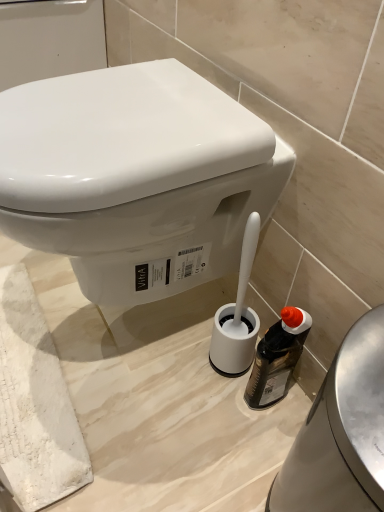
Question: Is white plastic toilet brush holder at lower center with translucent plastic bottle at lower right?

Choices:
 (A) no
 (B) yes

Answer: (A)

Question: Is white plastic toilet brush holder at lower center behind translucent plastic bottle at lower right?

Choices:
 (A) yes
 (B) no

Answer: (B)

Question: Does white plastic toilet brush holder at lower center appear on the right side of translucent plastic bottle at lower right?

Choices:
 (A) no
 (B) yes

Answer: (B)

Question: Does white plastic toilet brush holder at lower center appear on the left side of translucent plastic bottle at lower right?

Choices:
 (A) no
 (B) yes

Answer: (A)

Question: Considering the relative sizes of white plastic toilet brush holder at lower center and translucent plastic bottle at lower right in the image provided, is white plastic toilet brush holder at lower center shorter than translucent plastic bottle at lower right?

Choices:
 (A) no
 (B) yes

Answer: (A)

Question: From a real-world perspective, is white plastic toilet brush holder at lower center on top of translucent plastic bottle at lower right?

Choices:
 (A) yes
 (B) no

Answer: (A)

Question: Are white plastic toilet brush holder at lower center and white glossy toilet at center located far from each other?

Choices:
 (A) yes
 (B) no

Answer: (B)

Question: Does white plastic toilet brush holder at lower center come in front of white glossy toilet at center?

Choices:
 (A) no
 (B) yes

Answer: (B)

Question: Considering the relative sizes of white plastic toilet brush holder at lower center and white glossy toilet at center in the image provided, is white plastic toilet brush holder at lower center wider than white glossy toilet at center?

Choices:
 (A) no
 (B) yes

Answer: (A)

Question: Is white plastic toilet brush holder at lower center taller than white glossy toilet at center?

Choices:
 (A) yes
 (B) no

Answer: (A)

Question: From a real-world perspective, is white plastic toilet brush holder at lower center physically below white glossy toilet at center?

Choices:
 (A) yes
 (B) no

Answer: (A)

Question: From a real-world perspective, is white plastic toilet brush holder at lower center on white glossy toilet at center?

Choices:
 (A) no
 (B) yes

Answer: (A)

Question: Is white glossy toilet at center to the left of translucent plastic bottle at lower right from the viewer's perspective?

Choices:
 (A) no
 (B) yes

Answer: (B)